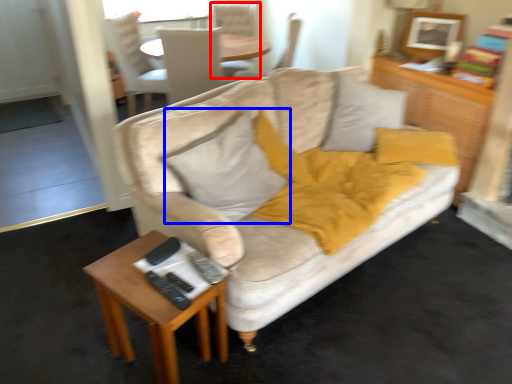
Question: Which point is closer to the camera, chair (highlighted by a red box) or pillow (highlighted by a blue box)?

Choices:
 (A) chair
 (B) pillow

Answer: (B)